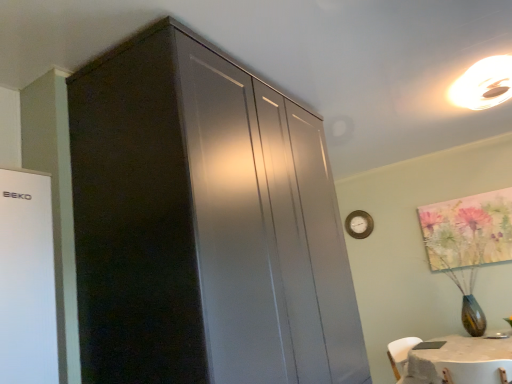
Question: Considering their positions, is wooden clock at upper right located in front of or behind watercolor floral painting at upper right?

Choices:
 (A) behind
 (B) front

Answer: (A)

Question: Based on their sizes in the image, would you say wooden clock at upper right is bigger or smaller than watercolor floral painting at upper right?

Choices:
 (A) big
 (B) small

Answer: (B)

Question: Estimate the real-world distances between objects in this image. Which object is farther from the wooden clock at upper right?

Choices:
 (A) matte black cabinet at upper left
 (B) matte white ceiling light at upper right
 (C) watercolor floral painting at upper right

Answer: (A)

Question: Which object is positioned closest to the matte black cabinet at upper left?

Choices:
 (A) wooden clock at upper right
 (B) matte white ceiling light at upper right
 (C) watercolor floral painting at upper right

Answer: (B)